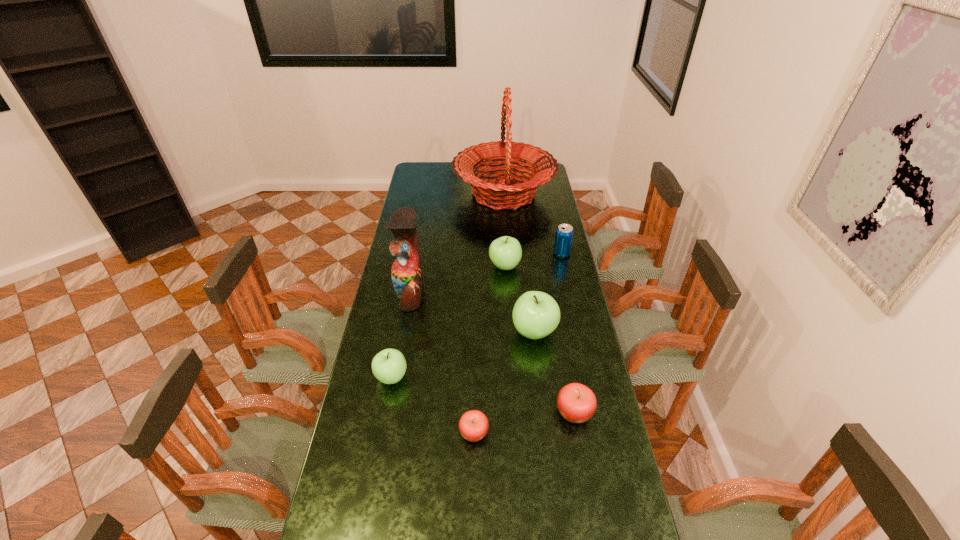
Locate an element on the screen. the tallest object is located at coordinates (504, 195).

Locate an element on the screen. This screenshot has height=540, width=960. basket is located at coordinates (504, 195).

Locate an element on the screen. The width and height of the screenshot is (960, 540). parrot is located at coordinates (406, 272).

You are a GUI agent. You are given a task and a screenshot of the screen. Output one action in this format:
    pyautogui.click(x=<x>, y=<y>)
    Task: Click on the biggest green apple
    This screenshot has height=540, width=960.
    Given the screenshot: What is the action you would take?
    pyautogui.click(x=536, y=314)

Where is `the second farthest apple`? This screenshot has width=960, height=540. the second farthest apple is located at coordinates (536, 314).

You are a GUI agent. You are given a task and a screenshot of the screen. Output one action in this format:
    pyautogui.click(x=<x>, y=<y>)
    Task: Click on the second tallest apple
    
    Given the screenshot: What is the action you would take?
    pyautogui.click(x=505, y=252)

Find the location of a particular element. the farthest green apple is located at coordinates (505, 252).

What are the coordinates of `blue pop soda` in the screenshot? It's located at (564, 233).

Where is `the third nearest object`? the third nearest object is located at coordinates (389, 366).

Where is `the smallest green apple`? The height and width of the screenshot is (540, 960). the smallest green apple is located at coordinates (389, 366).